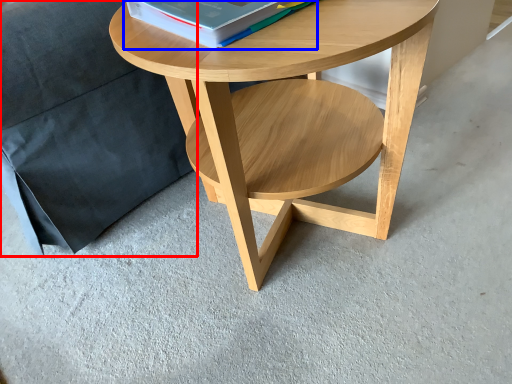
Question: Which object appears closest to the camera in this image, pillow (highlighted by a red box) or paperback book (highlighted by a blue box)?

Choices:
 (A) pillow
 (B) paperback book

Answer: (B)